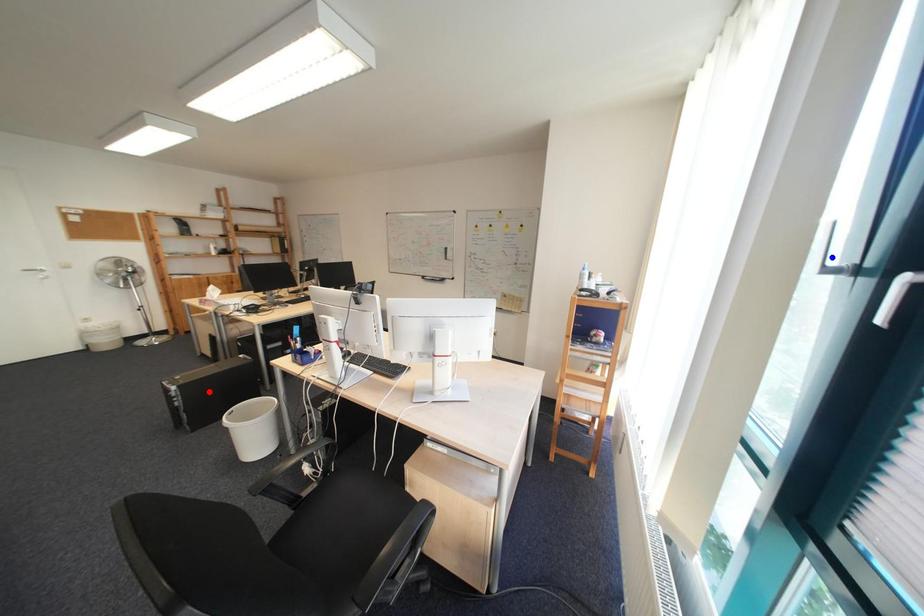
Question: Two points are marked on the image. Which point is closer to the camera?

Choices:
 (A) Blue point is closer.
 (B) Red point is closer.

Answer: (A)